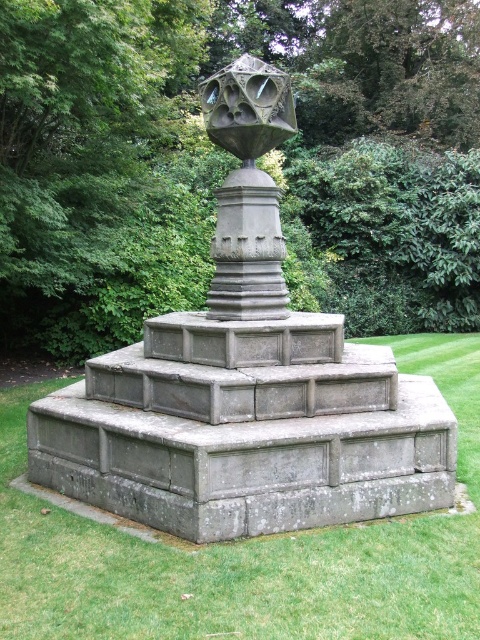
Question: Is the position of green grass at center less distant than that of polished stone sphere at center?

Choices:
 (A) yes
 (B) no

Answer: (A)

Question: Which of the following is the farthest from the observer?

Choices:
 (A) (213, 248)
 (B) (315, 577)
 (C) (217, 445)

Answer: (A)

Question: Does gray stone sculpture at center have a greater width compared to polished stone sphere at center?

Choices:
 (A) no
 (B) yes

Answer: (B)

Question: Does gray stone sculpture at center come behind green grass at center?

Choices:
 (A) no
 (B) yes

Answer: (B)

Question: Based on their relative distances, which object is farther from the polished stone sphere at center?

Choices:
 (A) green grass at center
 (B) gray stone sculpture at center

Answer: (A)

Question: Among these points, which one is farthest from the camera?

Choices:
 (A) (477, 412)
 (B) (259, 172)
 (C) (304, 460)

Answer: (A)